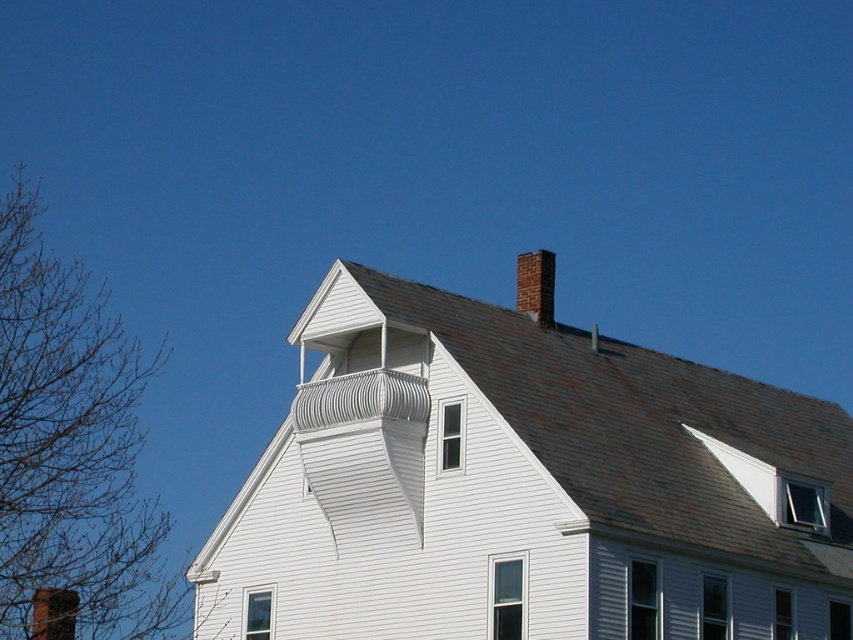
Looking at this image, you are standing at the base of the house looking up. You see the bare branches at left and the brown brick chimney at upper center. Which object is closer to you?

The brown brick chimney at upper center is closer to you since it is only 36.94 meters away from the bare branches at left, and since the branches are at the left side, the chimney is positioned higher up but in terms of distance from the observer at the base, the chimney being on the roof would naturally be farther away. Wait, but the description says the distance between them is 36.94 meters. Hmm, perhaps I need to clarify based on the given data. The question is which is closer to the observer. Since the